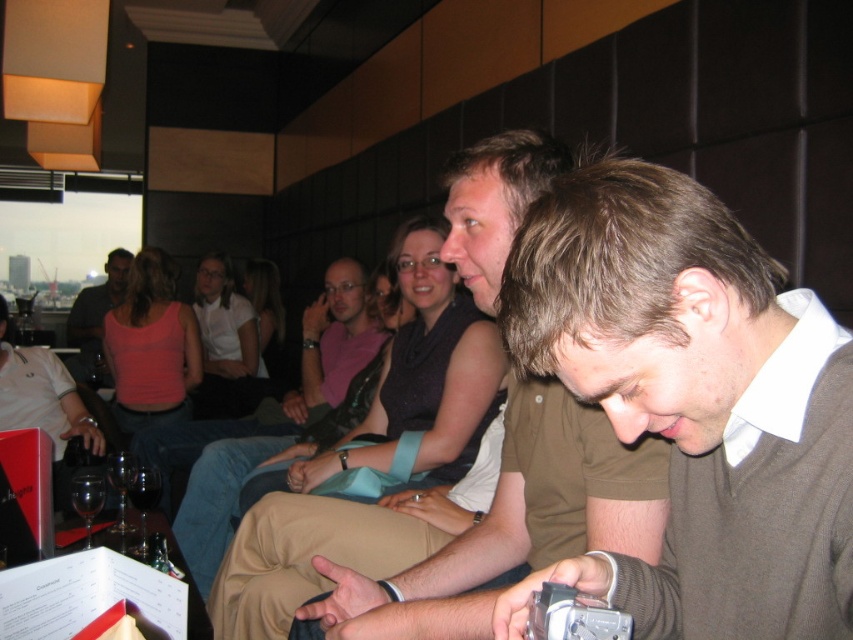
Who is higher up, brown sweater at center or matte black shirt at upper center?

brown sweater at center

Based on the photo, between brown sweater at center and matte black shirt at upper center, which one appears on the left side from the viewer's perspective?

matte black shirt at upper center is more to the left.

Who is more distant from viewer, (721, 529) or (77, 294)?

Point (77, 294)

Image resolution: width=853 pixels, height=640 pixels. What are the coordinates of `brown sweater at center` in the screenshot? It's located at (693, 403).

Does matte black shirt at upper center have a greater height compared to transparent glass wine glass at lower left?

Yes.

Between point (90, 316) and point (91, 486), which one is positioned behind?

Point (90, 316)

I want to click on matte black shirt at upper center, so click(96, 316).

Is brown sweater at center taller than matte white shirt at center?

In fact, brown sweater at center may be shorter than matte white shirt at center.

Describe the element at coordinates (693, 403) in the screenshot. I see `brown sweater at center` at that location.

The height and width of the screenshot is (640, 853). I want to click on brown sweater at center, so click(693, 403).

This screenshot has height=640, width=853. Find the location of `brown sweater at center`. brown sweater at center is located at coordinates (693, 403).